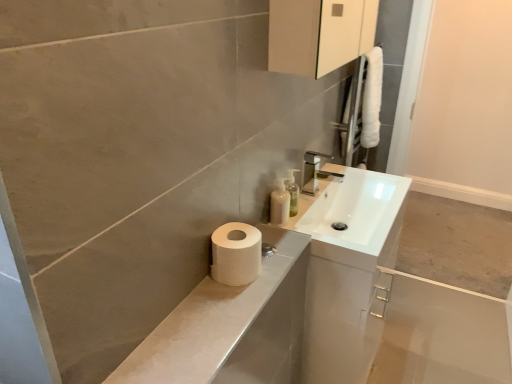
What is the approximate height of white matte toilet paper at lower left?

white matte toilet paper at lower left is 4.86 inches tall.

You are a GUI agent. You are given a task and a screenshot of the screen. Output one action in this format:
    pyautogui.click(x=<x>, y=<y>)
    Task: Click on the white matte toilet paper at lower left
    
    Given the screenshot: What is the action you would take?
    pyautogui.click(x=236, y=254)

What is the approximate width of translucent plastic soap dispenser at upper center?

The width of translucent plastic soap dispenser at upper center is 2.63 inches.

The width and height of the screenshot is (512, 384). What do you see at coordinates (232, 327) in the screenshot? I see `white matte toilet paper at lower left` at bounding box center [232, 327].

I want to click on translucent plastic soap dispenser at upper right, so (279, 204).

Consider the image. Is translucent plastic soap dispenser at upper center taller or shorter than translucent plastic soap dispenser at upper right?

Considering their sizes, translucent plastic soap dispenser at upper center has more height than translucent plastic soap dispenser at upper right.

Is translucent plastic soap dispenser at upper right a part of translucent plastic soap dispenser at upper center?

No, translucent plastic soap dispenser at upper right is not inside translucent plastic soap dispenser at upper center.

Can you confirm if translucent plastic soap dispenser at upper center is smaller than translucent plastic soap dispenser at upper right?

Indeed, translucent plastic soap dispenser at upper center has a smaller size compared to translucent plastic soap dispenser at upper right.

Is white matte toilet paper at lower left bigger or smaller than white matte toilet paper at lower left?

white matte toilet paper at lower left is bigger than white matte toilet paper at lower left.

Is the position of white matte toilet paper at lower left less distant than that of white matte toilet paper at lower left?

Yes, it is in front of white matte toilet paper at lower left.

Is white matte toilet paper at lower left completely or partially outside of white matte toilet paper at lower left?

Yes.

Considering the sizes of white matte toilet paper at lower left and white matte toilet paper at lower left in the image, is white matte toilet paper at lower left taller or shorter than white matte toilet paper at lower left?

In the image, white matte toilet paper at lower left appears to be shorter than white matte toilet paper at lower left.

Is translucent plastic soap dispenser at upper right facing towards white glossy sink at upper right?

Yes, translucent plastic soap dispenser at upper right is aimed at white glossy sink at upper right.

Is translucent plastic soap dispenser at upper right behind white glossy sink at upper right?

That is True.

What's the angular difference between translucent plastic soap dispenser at upper right and white glossy sink at upper right's facing directions?

They differ by 0.169 degrees in their facing directions.

Can you confirm if translucent plastic soap dispenser at upper right is bigger than white glossy sink at upper right?

No, translucent plastic soap dispenser at upper right is not bigger than white glossy sink at upper right.

Does white matte toilet paper at lower left have a larger size compared to translucent plastic soap dispenser at upper right?

Indeed, white matte toilet paper at lower left has a larger size compared to translucent plastic soap dispenser at upper right.

Considering the relative sizes of white matte toilet paper at lower left and translucent plastic soap dispenser at upper right in the image provided, is white matte toilet paper at lower left thinner than translucent plastic soap dispenser at upper right?

No, white matte toilet paper at lower left is not thinner than translucent plastic soap dispenser at upper right.

Considering the sizes of white matte toilet paper at lower left and translucent plastic soap dispenser at upper right in the image, is white matte toilet paper at lower left taller or shorter than translucent plastic soap dispenser at upper right?

In the image, white matte toilet paper at lower left appears to be shorter than translucent plastic soap dispenser at upper right.

Does white matte toilet paper at lower left have a larger size compared to white matte toilet paper at lower left?

Incorrect, white matte toilet paper at lower left is not larger than white matte toilet paper at lower left.

Find the location of `toilet paper above the white matte toilet paper at lower left (from the image's perspective)`. toilet paper above the white matte toilet paper at lower left (from the image's perspective) is located at coordinates (236, 254).

From the image's perspective, is white matte toilet paper at lower left under white matte toilet paper at lower left?

Incorrect, from the image's perspective, white matte toilet paper at lower left is higher than white matte toilet paper at lower left.

Image resolution: width=512 pixels, height=384 pixels. In order to click on toiletry above the white matte toilet paper at lower left (from the image's perspective) in this screenshot , I will do `click(279, 204)`.

Is translucent plastic soap dispenser at upper right in front of or behind white matte toilet paper at lower left in the image?

In the image, translucent plastic soap dispenser at upper right appears behind white matte toilet paper at lower left.

How different are the orientations of translucent plastic soap dispenser at upper right and white matte toilet paper at lower left in degrees?

The facing directions of translucent plastic soap dispenser at upper right and white matte toilet paper at lower left are 1.93 degrees apart.

Is translucent plastic soap dispenser at upper right to the left or to the right of white matte toilet paper at lower left in the image?

From the image, it's evident that translucent plastic soap dispenser at upper right is to the right of white matte toilet paper at lower left.

Does white glossy sink at upper right appear on the right side of translucent plastic soap dispenser at upper center?

Correct, you'll find white glossy sink at upper right to the right of translucent plastic soap dispenser at upper center.

Image resolution: width=512 pixels, height=384 pixels. I want to click on soap dispenser positioned vertically above the white glossy sink at upper right (from a real-world perspective), so click(x=292, y=191).

From a real-world perspective, is white glossy sink at upper right positioned above or below translucent plastic soap dispenser at upper center?

In terms of real-world spatial position, white glossy sink at upper right is below translucent plastic soap dispenser at upper center.

Is white glossy sink at upper right aimed at translucent plastic soap dispenser at upper center?

No.

Locate an element on the screen. soap dispenser that is above the translucent plastic soap dispenser at upper right (from the image's perspective) is located at coordinates (292, 191).

Image resolution: width=512 pixels, height=384 pixels. I want to click on toilet paper behind the white matte toilet paper at lower left, so click(x=236, y=254).

Looking at the image, which one is located closer to translucent plastic soap dispenser at upper right, white matte toilet paper at lower left or white glossy sink at upper right?

white glossy sink at upper right.

Considering their positions, is translucent plastic soap dispenser at upper center positioned closer to translucent plastic soap dispenser at upper right than white glossy sink at upper right?

Based on the image, translucent plastic soap dispenser at upper center appears to be nearer to translucent plastic soap dispenser at upper right.

When comparing their distances from translucent plastic soap dispenser at upper center, does white matte toilet paper at lower left or translucent plastic soap dispenser at upper right seem further?

white matte toilet paper at lower left is positioned further to the anchor translucent plastic soap dispenser at upper center.

Estimate the real-world distances between objects in this image. Which object is closer to white matte toilet paper at lower left, white glossy sink at upper right or translucent plastic soap dispenser at upper center?

white glossy sink at upper right.

Estimate the real-world distances between objects in this image. Which object is further from white matte toilet paper at lower left, white glossy sink at upper right or translucent plastic soap dispenser at upper center?

The object further to white matte toilet paper at lower left is white glossy sink at upper right.

When comparing their distances from white glossy sink at upper right, does translucent plastic soap dispenser at upper right or white matte toilet paper at lower left seem further?

Based on the image, white matte toilet paper at lower left appears to be further to white glossy sink at upper right.

Considering their positions, is white glossy sink at upper right positioned further to translucent plastic soap dispenser at upper right than translucent plastic soap dispenser at upper center?

white glossy sink at upper right is further to translucent plastic soap dispenser at upper right.

Based on their spatial positions, is translucent plastic soap dispenser at upper right or white glossy sink at upper right closer to white matte toilet paper at lower left?

translucent plastic soap dispenser at upper right lies closer to white matte toilet paper at lower left than the other object.

Find the location of `soap dispenser between translucent plastic soap dispenser at upper right and white glossy sink at upper right in the horizontal direction`. soap dispenser between translucent plastic soap dispenser at upper right and white glossy sink at upper right in the horizontal direction is located at coordinates (292, 191).

Find the location of a particular element. The height and width of the screenshot is (384, 512). toiletry between white matte toilet paper at lower left and translucent plastic soap dispenser at upper center along the z-axis is located at coordinates (279, 204).

The width and height of the screenshot is (512, 384). Identify the location of toilet paper located between white matte toilet paper at lower left and translucent plastic soap dispenser at upper center in the depth direction. (236, 254).

Locate an element on the screen. Image resolution: width=512 pixels, height=384 pixels. sink between white matte toilet paper at lower left and translucent plastic soap dispenser at upper right along the z-axis is located at coordinates (355, 216).